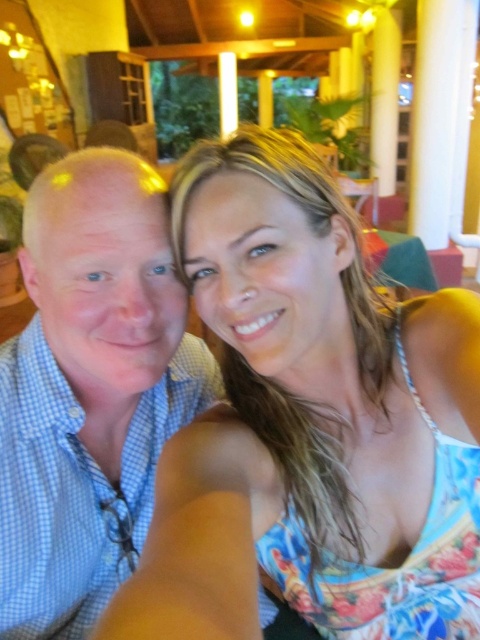
You are standing in the background of the image and want to hand a drink to both the floral fabric dress at center and the blue checkered shirt at left. Which one can you reach first without moving your position?

The floral fabric dress at center can be reached first because it is closer to the viewer than the blue checkered shirt at left.

You are trying to locate the floral fabric dress at center in the image. According to the coordinates provided, where exactly is it positioned?

The floral fabric dress at center is located at point coordinates of (310, 422).

You are a photographer trying to capture a closeup shot of both the floral fabric dress at center and the blue checkered shirt at left. Given that the dress is larger than the shirt, which clothing item would require more space in the frame to fully capture its details?

The floral fabric dress at center is larger in size than the blue checkered shirt at left, so it would require more space in the frame to fully capture its details.